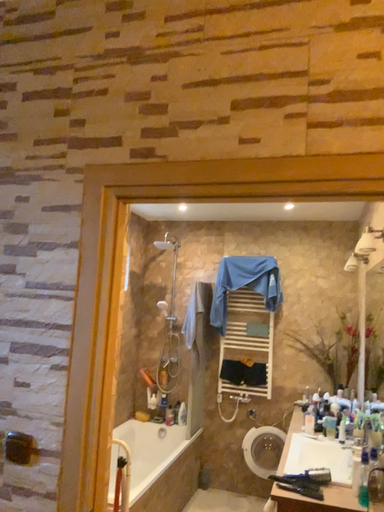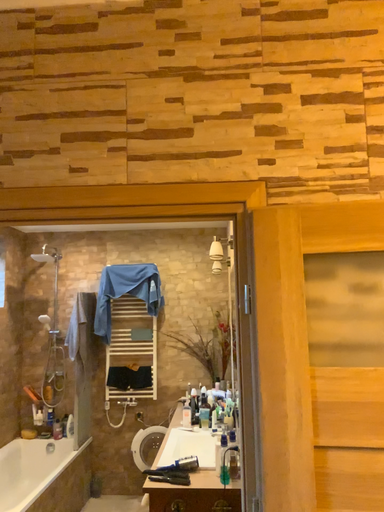
Question: Which way did the camera rotate in the video?

Choices:
 (A) rotated right
 (B) rotated left

Answer: (A)